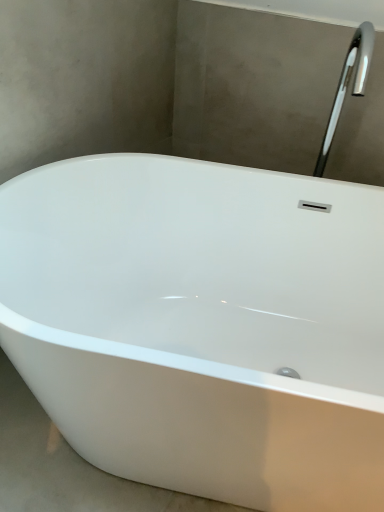
Identify the location of polished chrome tap at upper right. This screenshot has width=384, height=512. (347, 85).

This screenshot has height=512, width=384. What do you see at coordinates (347, 85) in the screenshot?
I see `polished chrome tap at upper right` at bounding box center [347, 85].

In order to face polished chrome tap at upper right, should I rotate leftwards or rightwards?

You should look right and rotate roughly 18.986 degrees.

What is the approximate height of polished chrome tap at upper right?

polished chrome tap at upper right is 22.95 inches in height.

The height and width of the screenshot is (512, 384). What do you see at coordinates (203, 325) in the screenshot? I see `white glossy bathtub at center` at bounding box center [203, 325].

Locate an element on the screen. The image size is (384, 512). white glossy bathtub at center is located at coordinates (203, 325).

The height and width of the screenshot is (512, 384). What are the coordinates of `polished chrome tap at upper right` in the screenshot? It's located at (347, 85).

Does white glossy bathtub at center appear on the right side of polished chrome tap at upper right?

Incorrect, white glossy bathtub at center is not on the right side of polished chrome tap at upper right.

Which is in front, white glossy bathtub at center or polished chrome tap at upper right?

white glossy bathtub at center.

Which is behind, point (80, 197) or point (332, 106)?

The point (332, 106) is more distant.

From the image's perspective, does white glossy bathtub at center appear higher than polished chrome tap at upper right?

No, from the image's perspective, white glossy bathtub at center is not on top of polished chrome tap at upper right.

From a real-world perspective, who is located lower, white glossy bathtub at center or polished chrome tap at upper right?

In real-world perspective, white glossy bathtub at center is lower.

From the picture: Between white glossy bathtub at center and polished chrome tap at upper right, which one has larger width?

With larger width is white glossy bathtub at center.

Which of these two, white glossy bathtub at center or polished chrome tap at upper right, stands shorter?

polished chrome tap at upper right is shorter.

Who is smaller, white glossy bathtub at center or polished chrome tap at upper right?

polished chrome tap at upper right.

Is white glossy bathtub at center completely or partially outside of polished chrome tap at upper right?

That's correct, white glossy bathtub at center is outside of polished chrome tap at upper right.

Is white glossy bathtub at center positioned far away from polished chrome tap at upper right?

That's not correct — white glossy bathtub at center is a little close to polished chrome tap at upper right.

Is white glossy bathtub at center oriented away from polished chrome tap at upper right?

No.

Can you tell me how much white glossy bathtub at center and polished chrome tap at upper right differ in facing direction?

1.14 degrees.

In the image, there is a polished chrome tap at upper right. Where is `bathtub below it (from the image's perspective)`? Image resolution: width=384 pixels, height=512 pixels. bathtub below it (from the image's perspective) is located at coordinates (203, 325).

Can you confirm if polished chrome tap at upper right is positioned to the right of white glossy bathtub at center?

Yes, polished chrome tap at upper right is to the right of white glossy bathtub at center.

Which is behind, polished chrome tap at upper right or white glossy bathtub at center?

polished chrome tap at upper right.

Is point (325, 140) behind point (67, 212)?

Yes.

Consider the image. From the image's perspective, which is above, polished chrome tap at upper right or white glossy bathtub at center?

From the image's view, polished chrome tap at upper right is above.

From a real-world perspective, which object stands above the other?

polished chrome tap at upper right is physically above.

Between polished chrome tap at upper right and white glossy bathtub at center, which one has larger width?

white glossy bathtub at center is wider.

Considering the relative sizes of polished chrome tap at upper right and white glossy bathtub at center in the image provided, is polished chrome tap at upper right shorter than white glossy bathtub at center?

Indeed, polished chrome tap at upper right has a lesser height compared to white glossy bathtub at center.

Considering the sizes of objects polished chrome tap at upper right and white glossy bathtub at center in the image provided, who is bigger, polished chrome tap at upper right or white glossy bathtub at center?

Bigger between the two is white glossy bathtub at center.

Is polished chrome tap at upper right completely or partially outside of white glossy bathtub at center?

polished chrome tap at upper right lies outside white glossy bathtub at center's area.

Is polished chrome tap at upper right in contact with white glossy bathtub at center?

No, polished chrome tap at upper right is not next to white glossy bathtub at center.

Is polished chrome tap at upper right aimed at white glossy bathtub at center?

No, polished chrome tap at upper right is not oriented towards white glossy bathtub at center.

How many degrees apart are the facing directions of polished chrome tap at upper right and white glossy bathtub at center?

1.14 degrees.

Identify the location of tap that is above the white glossy bathtub at center (from the image's perspective). (347, 85).

At what (x,y) coordinates should I click in order to perform the action: click on bathtub in front of the polished chrome tap at upper right. Please return your answer as a coordinate pair (x, y). Image resolution: width=384 pixels, height=512 pixels. Looking at the image, I should click on (203, 325).

You are a GUI agent. You are given a task and a screenshot of the screen. Output one action in this format:
    pyautogui.click(x=<x>, y=<y>)
    Task: Click on the tap above the white glossy bathtub at center (from a real-world perspective)
    
    Given the screenshot: What is the action you would take?
    pyautogui.click(x=347, y=85)